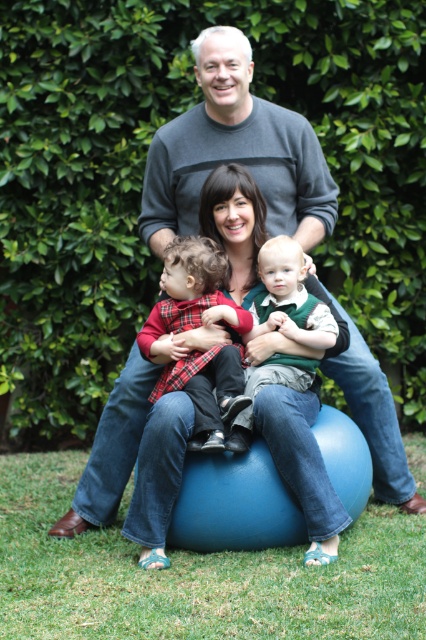
Is plaid fabric shirt at center bigger than green fuzzy vest at center?

Yes, plaid fabric shirt at center is bigger than green fuzzy vest at center.

From the picture: Who is more forward, [198,282] or [250,387]?

Positioned in front is point [250,387].

Who is more distant from viewer, (x=209, y=301) or (x=285, y=248)?

Point (x=209, y=301)

Find the location of `plaid fabric shirt at center`. plaid fabric shirt at center is located at coordinates (195, 326).

Identify the location of gray sweater at upper center. This screenshot has height=640, width=426. (235, 152).

This screenshot has width=426, height=640. Describe the element at coordinates (235, 152) in the screenshot. I see `gray sweater at upper center` at that location.

Where is `gray sweater at upper center`? This screenshot has height=640, width=426. gray sweater at upper center is located at coordinates (235, 152).

Can you confirm if gray sweater at upper center is positioned below green fuzzy vest at center?

No.

Which is behind, point (290, 157) or point (316, 304)?

Point (290, 157)

Locate an element on the screen. This screenshot has height=640, width=426. gray sweater at upper center is located at coordinates (235, 152).